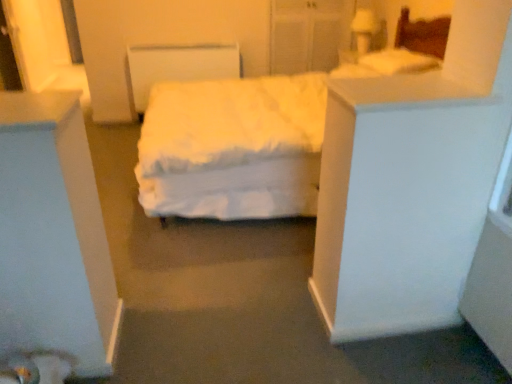
What do you see at coordinates (396, 62) in the screenshot?
I see `white soft pillow at upper right` at bounding box center [396, 62].

The image size is (512, 384). Identify the location of white soft pillow at upper right. (396, 62).

What is the approximate width of white soft pillow at upper right?

16.35 inches.

What is the approximate height of white soft bed at center?

white soft bed at center is 3.66 feet in height.

You are a GUI agent. You are given a task and a screenshot of the screen. Output one action in this format:
    pyautogui.click(x=<x>, y=<y>)
    Task: Click on the white soft bed at center
    Image resolution: width=512 pixels, height=384 pixels.
    Given the screenshot: What is the action you would take?
    pyautogui.click(x=234, y=146)

This screenshot has width=512, height=384. Describe the element at coordinates (234, 146) in the screenshot. I see `white soft bed at center` at that location.

Find the location of a particular element. This screenshot has width=512, height=384. white soft pillow at upper right is located at coordinates (396, 62).

Is white soft pillow at upper right to the left or to the right of white soft bed at center in the image?

In the image, white soft pillow at upper right appears on the right side of white soft bed at center.

From the picture: Is white soft pillow at upper right further to camera compared to white soft bed at center?

Yes, white soft pillow at upper right is further from the camera.

Considering the positions of points (426, 69) and (215, 141), is point (426, 69) farther from camera compared to point (215, 141)?

No, (426, 69) is in front of (215, 141).

From the image's perspective, who appears lower, white soft pillow at upper right or white soft bed at center?

From the image's view, white soft bed at center is below.

In the scene shown: From a real-world perspective, is white soft pillow at upper right located higher than white soft bed at center?

Yes, from a real-world perspective, white soft pillow at upper right is over white soft bed at center

Between white soft pillow at upper right and white soft bed at center, which one has smaller width?

white soft pillow at upper right is thinner.

Considering the sizes of objects white soft pillow at upper right and white soft bed at center in the image provided, who is shorter, white soft pillow at upper right or white soft bed at center?

Standing shorter between the two is white soft pillow at upper right.

Is white soft pillow at upper right bigger than white soft bed at center?

No, white soft pillow at upper right is not bigger than white soft bed at center.

Is white soft pillow at upper right completely or partially outside of white soft bed at center?

That's incorrect, white soft pillow at upper right is not completely outside white soft bed at center.

Is there a large distance between white soft pillow at upper right and white soft bed at center?

white soft pillow at upper right is near white soft bed at center, not far away.

Does white soft pillow at upper right turn towards white soft bed at center?

Yes, white soft pillow at upper right is turned towards white soft bed at center.

You are a GUI agent. You are given a task and a screenshot of the screen. Output one action in this format:
    pyautogui.click(x=<x>, y=<y>)
    Task: Click on the pillow lying on the right of white soft bed at center
    The width and height of the screenshot is (512, 384).
    Given the screenshot: What is the action you would take?
    pyautogui.click(x=396, y=62)

Is white soft bed at center at the right side of white soft pillow at upper right?

No, white soft bed at center is not to the right of white soft pillow at upper right.

Is white soft bed at center in front of or behind white soft pillow at upper right in the image?

white soft bed at center is positioned closer to the viewer than white soft pillow at upper right.

Is point (167, 193) closer or farther from the camera than point (425, 60)?

Clearly, point (167, 193) is closer to the camera than point (425, 60).

From the image's perspective, does white soft bed at center appear lower than white soft pillow at upper right?

Yes, from the image's perspective, white soft bed at center is beneath white soft pillow at upper right.

From a real-world perspective, which is physically below, white soft bed at center or white soft pillow at upper right?

white soft bed at center.

Considering the sizes of objects white soft bed at center and white soft pillow at upper right in the image provided, who is wider, white soft bed at center or white soft pillow at upper right?

white soft bed at center.

Which of these two, white soft bed at center or white soft pillow at upper right, stands taller?

With more height is white soft bed at center.

In the scene shown: In terms of size, does white soft bed at center appear bigger or smaller than white soft pillow at upper right?

Clearly, white soft bed at center is larger in size than white soft pillow at upper right.

Can white soft pillow at upper right be found inside white soft bed at center?

Yes, white soft pillow at upper right is inside white soft bed at center.

Does white soft bed at center touch white soft pillow at upper right?

No, white soft bed at center is not touching white soft pillow at upper right.

Is white soft bed at center facing away from white soft pillow at upper right?

Yes, white soft pillow at upper right is at the back of white soft bed at center.

What's the angular difference between white soft bed at center and white soft pillow at upper right's facing directions?

The angle between the facing direction of white soft bed at center and the facing direction of white soft pillow at upper right is 0.957 degrees.

The image size is (512, 384). I want to click on pillow behind the white soft bed at center, so click(396, 62).

Where is `bed below the white soft pillow at upper right (from the image's perspective)`? bed below the white soft pillow at upper right (from the image's perspective) is located at coordinates (234, 146).

Locate an element on the screen. The width and height of the screenshot is (512, 384). pillow behind the white soft bed at center is located at coordinates (396, 62).